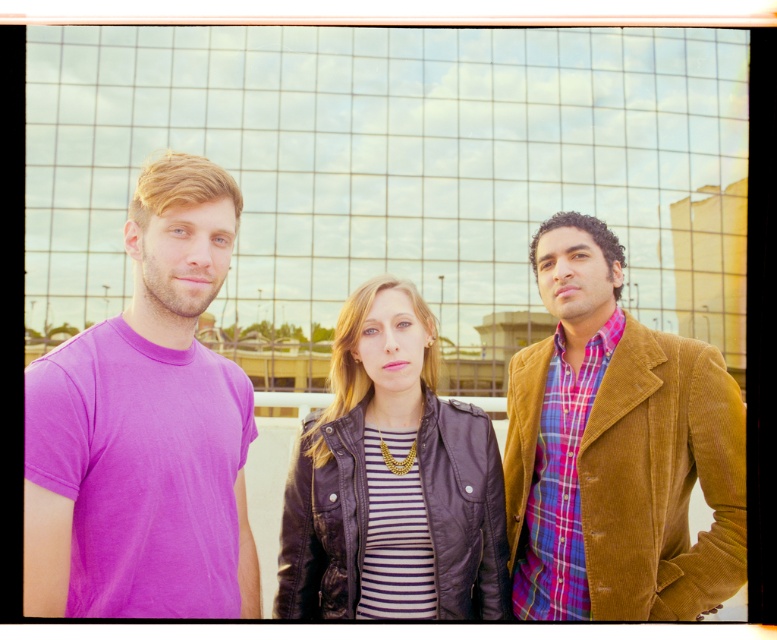
You are standing in front of the modern glass building and want to take a photo of the corduroy jacket at right and the leather jacket at center. Which jacket will appear larger in the photo?

The corduroy jacket at right appears larger in the photo because it is closer to the viewer than the leather jacket at center.

In the scene shown: You are standing in front of the modern glass building and see the three people. The coordinates of the purple cotton tshirt at left are given as point (145, 429). If you want to locate the purple cotton tshirt at left, where should you look relative to the image?

The purple cotton tshirt at left is located at the coordinates point (145, 429), so you should look towards the left side of the image to find it.